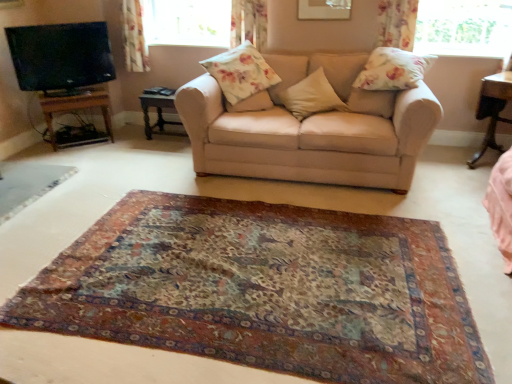
Question: Is floral fabric pillow at center, positioned as the 2th pillow in left-to-right order, at the left side of transparent glass window at upper right, which is the 1th window in right-to-left order?

Choices:
 (A) no
 (B) yes

Answer: (B)

Question: Is floral fabric pillow at center, positioned as the 2th pillow in left-to-right order, to the right of transparent glass window at upper right, which is the 2th window in back-to-front order, from the viewer's perspective?

Choices:
 (A) yes
 (B) no

Answer: (B)

Question: Is floral fabric pillow at center, positioned as the 2th pillow in left-to-right order, not near transparent glass window at upper right, which is the 1th window in right-to-left order?

Choices:
 (A) yes
 (B) no

Answer: (A)

Question: Is floral fabric pillow at center, positioned as the 2th pillow in left-to-right order, behind transparent glass window at upper right, which is the 1th window in right-to-left order?

Choices:
 (A) no
 (B) yes

Answer: (A)

Question: Is floral fabric pillow at center, positioned as the 2th pillow in left-to-right order, outside transparent glass window at upper right, placed as the first window when sorted from front to back?

Choices:
 (A) no
 (B) yes

Answer: (B)

Question: Does point (394, 82) appear closer or farther from the camera than point (265, 241)?

Choices:
 (A) farther
 (B) closer

Answer: (A)

Question: From a real-world perspective, is floral fabric pillow at upper right, the 4th pillow positioned from the left, above or below carpeted mat at center?

Choices:
 (A) below
 (B) above

Answer: (B)

Question: Would you say floral fabric pillow at upper right, placed as the 1th pillow when sorted from right to left, is to the left or to the right of carpeted mat at center in the picture?

Choices:
 (A) left
 (B) right

Answer: (B)

Question: In terms of size, does floral fabric pillow at upper right, placed as the 1th pillow when sorted from right to left, appear bigger or smaller than carpeted mat at center?

Choices:
 (A) big
 (B) small

Answer: (B)

Question: Which is correct: floral fabric curtain at upper right, the 1th curtain viewed from the right, is inside transparent glass window at upper center, which is counted as the 2th window, starting from the front, or outside of it?

Choices:
 (A) inside
 (B) outside

Answer: (B)

Question: From a real-world perspective, relative to transparent glass window at upper center, acting as the first window starting from the back, is floral fabric curtain at upper right, the third curtain from the left, vertically above or below?

Choices:
 (A) above
 (B) below

Answer: (A)

Question: Is point (388, 8) closer or farther from the camera than point (177, 41)?

Choices:
 (A) closer
 (B) farther

Answer: (A)

Question: Considering their positions, is floral fabric curtain at upper right, the third curtain from the left, located in front of or behind transparent glass window at upper center, which is counted as the 2th window, starting from the front?

Choices:
 (A) front
 (B) behind

Answer: (A)

Question: Considering the positions of point (366, 66) and point (123, 9), is point (366, 66) closer or farther from the camera than point (123, 9)?

Choices:
 (A) farther
 (B) closer

Answer: (B)

Question: Based on their sizes in the image, would you say floral fabric pillow at upper right, placed as the 1th pillow when sorted from right to left, is bigger or smaller than floral fabric curtain at upper left, the 1th curtain in the left-to-right sequence?

Choices:
 (A) big
 (B) small

Answer: (A)